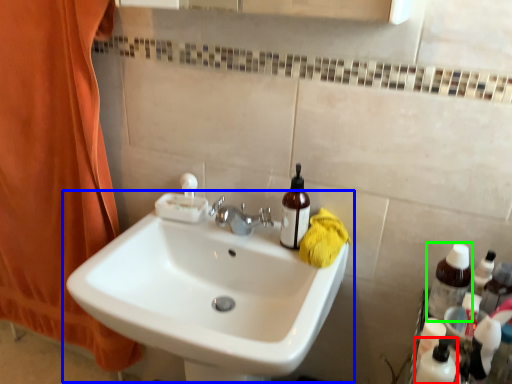
Question: Considering the real-world distances, which object is farthest from toiletry (highlighted by a red box)? sink (highlighted by a blue box) or bottle (highlighted by a green box)?

Choices:
 (A) sink
 (B) bottle

Answer: (A)